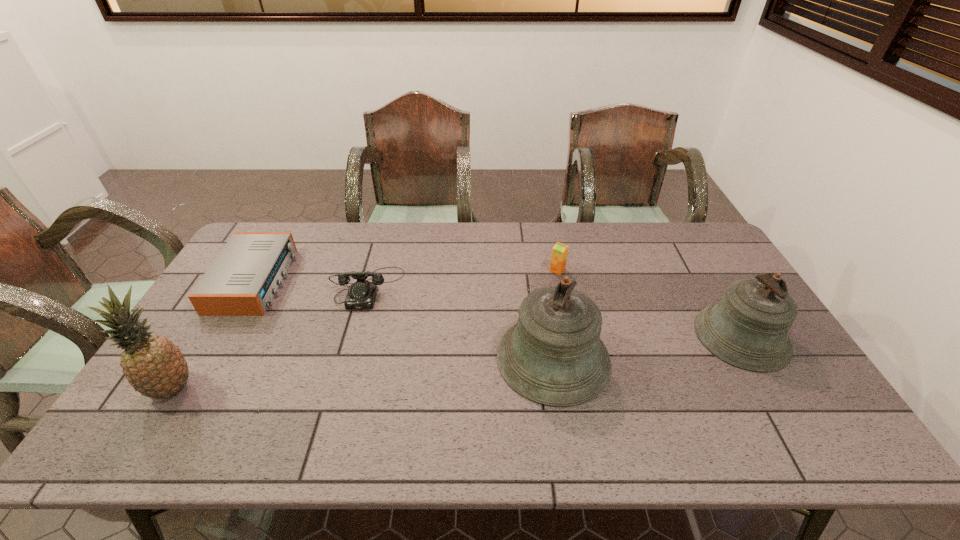
Where is `free space located on the front panel of the radio receiver`? The height and width of the screenshot is (540, 960). free space located on the front panel of the radio receiver is located at coordinates (340, 280).

I want to click on free spot located on the right of the pineapple, so click(x=232, y=389).

The width and height of the screenshot is (960, 540). I want to click on vacant region located on the front-facing side of the telephone, so click(350, 347).

Locate an element on the screen. The height and width of the screenshot is (540, 960). object present at the far edge is located at coordinates (242, 280).

Where is `bell located at the near edge`? bell located at the near edge is located at coordinates (553, 355).

At what (x,y) coordinates should I click in order to perform the action: click on pineapple that is positioned at the near edge. Please return your answer as a coordinate pair (x, y). Looking at the image, I should click on (154, 366).

This screenshot has height=540, width=960. I want to click on radio receiver at the left edge, so click(x=242, y=280).

Identify the location of pineapple positioned at the left edge. The image size is (960, 540). (154, 366).

Find the location of a particular element. This screenshot has width=960, height=540. object that is at the right edge is located at coordinates (748, 328).

Find the location of `object located in the far left corner section of the desktop`. object located in the far left corner section of the desktop is located at coordinates (242, 280).